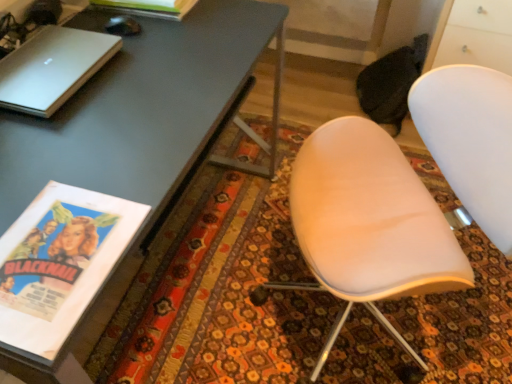
Find the location of a particular element. free space between matte paper magazine at upper left and silver metallic laptop at upper left is located at coordinates (119, 36).